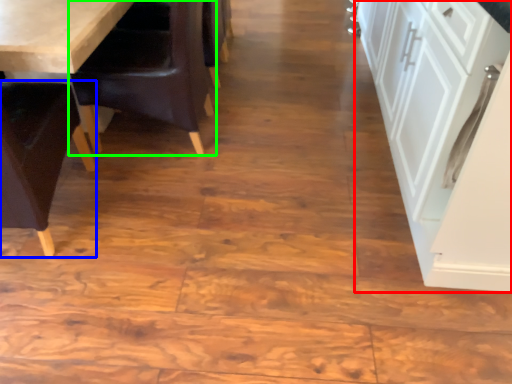
Question: Based on their relative distances, which object is farther from cabinetry (highlighted by a red box)? Choose from chair (highlighted by a blue box) and chair (highlighted by a green box).

Choices:
 (A) chair
 (B) chair

Answer: (A)